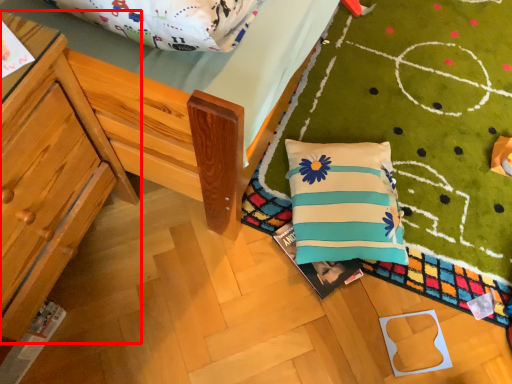
Question: In this image, where is furniture (annotated by the red box) located relative to pillow?

Choices:
 (A) left
 (B) right

Answer: (A)